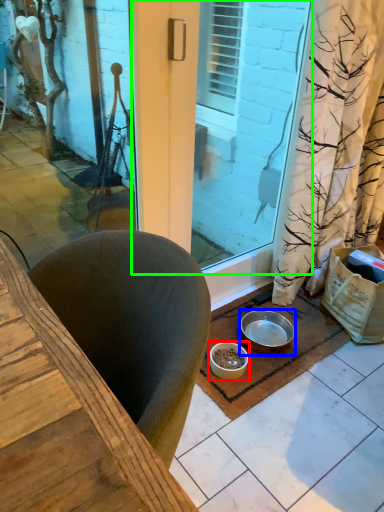
Question: Based on their relative distances, which object is farther from bowl (highlighted by a red box)? Choose from bowl (highlighted by a blue box) and screen door (highlighted by a green box).

Choices:
 (A) bowl
 (B) screen door

Answer: (B)